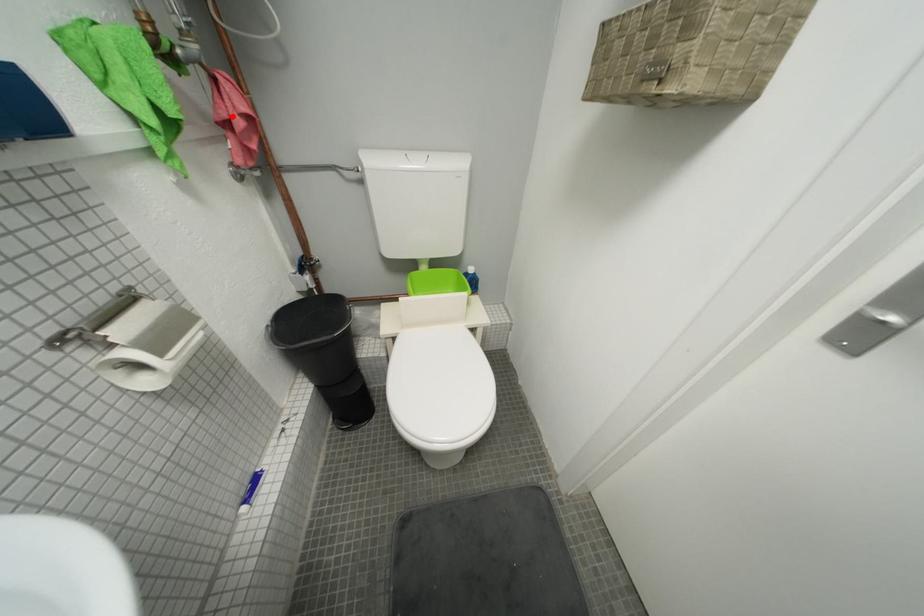
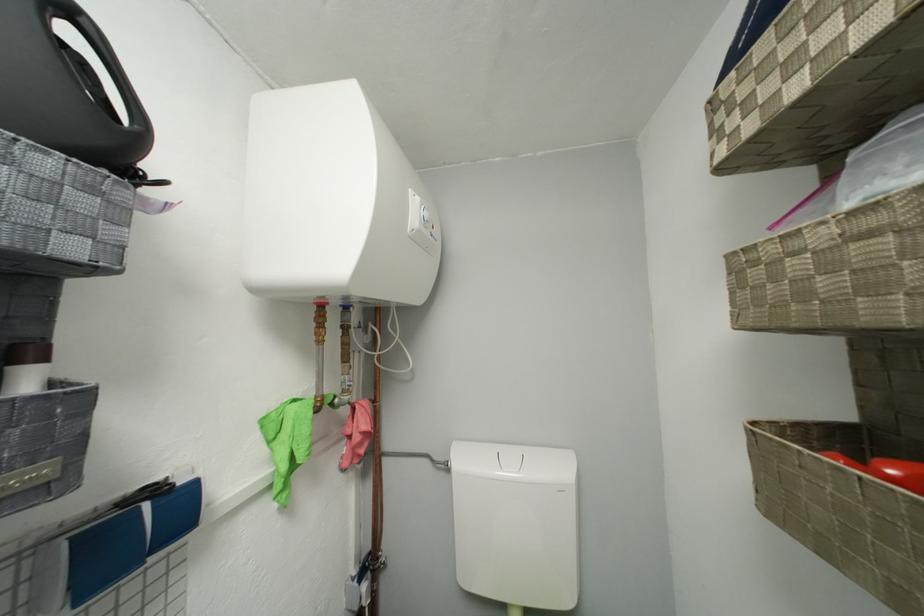
The point at the highlighted location is marked in the first image. Where is the corresponding point in the second image?

(358, 435)